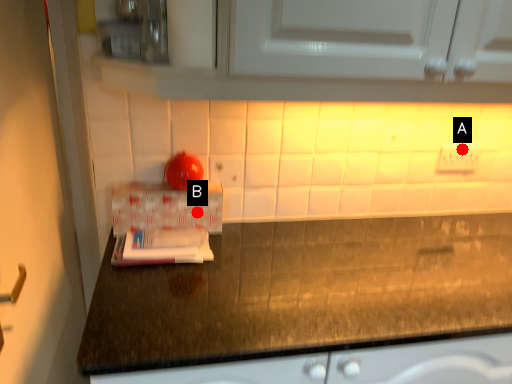
Question: Two points are circled on the image, labeled by A and B beside each circle. Among these points, which one is farthest from the camera?

Choices:
 (A) A is further
 (B) B is further

Answer: (A)